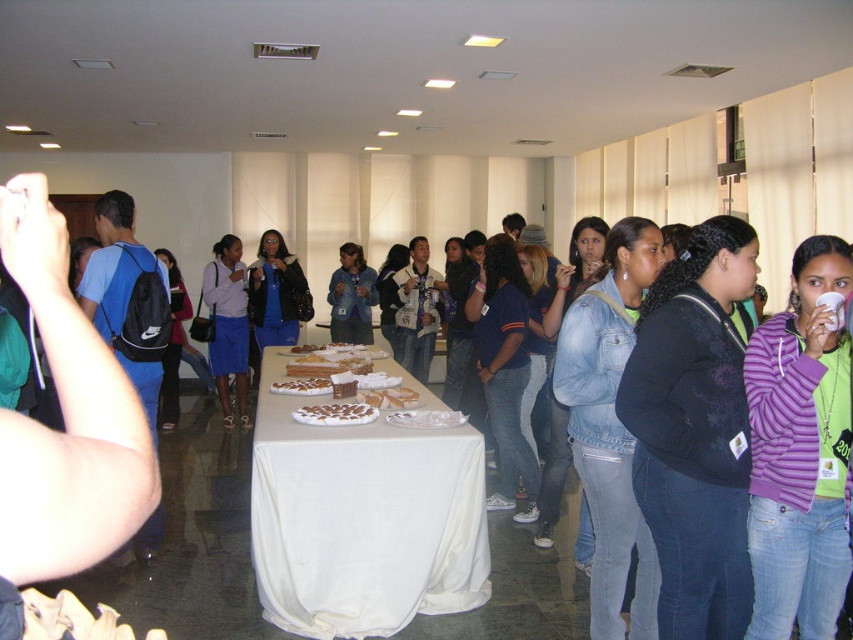
Question: Which object is farther from the camera taking this photo?

Choices:
 (A) white glossy plate at center
 (B) white cloth table at center

Answer: (A)

Question: Considering the relative positions of chocolate-coated nuts at center and golden brown pastry at center in the image provided, where is chocolate-coated nuts at center located with respect to golden brown pastry at center?

Choices:
 (A) below
 (B) above

Answer: (A)

Question: Does chocolate-coated nuts at center appear on the left side of white glossy plate at center?

Choices:
 (A) no
 (B) yes

Answer: (B)

Question: Can you confirm if white cloth table at center is thinner than golden brown pastry at center?

Choices:
 (A) yes
 (B) no

Answer: (B)

Question: Which of these objects is positioned farthest from the chocolate-coated nuts at center?

Choices:
 (A) golden brown pastry at center
 (B) white cloth table at center
 (C) white glossy plate at center

Answer: (A)

Question: Which point is closer to the camera taking this photo?

Choices:
 (A) (291, 381)
 (B) (338, 413)

Answer: (B)